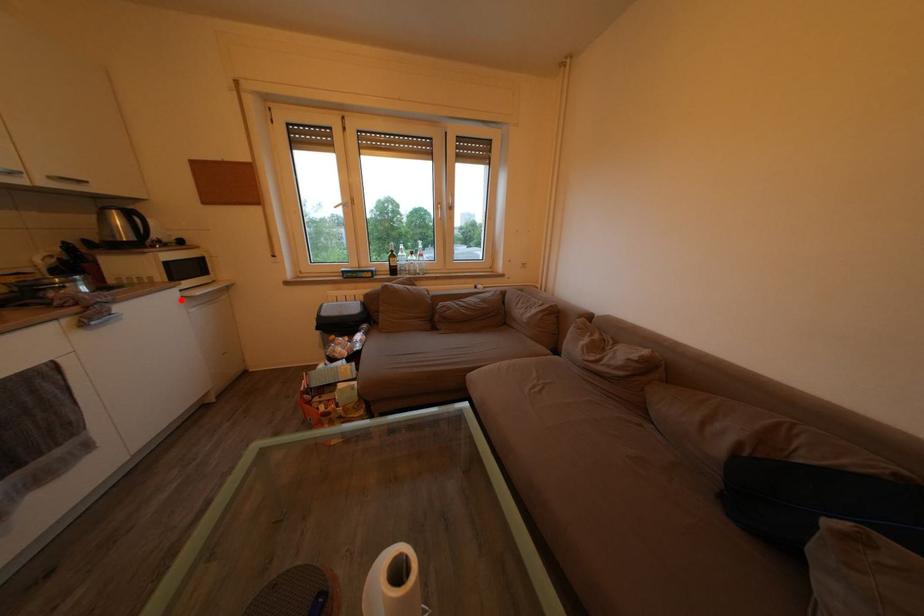
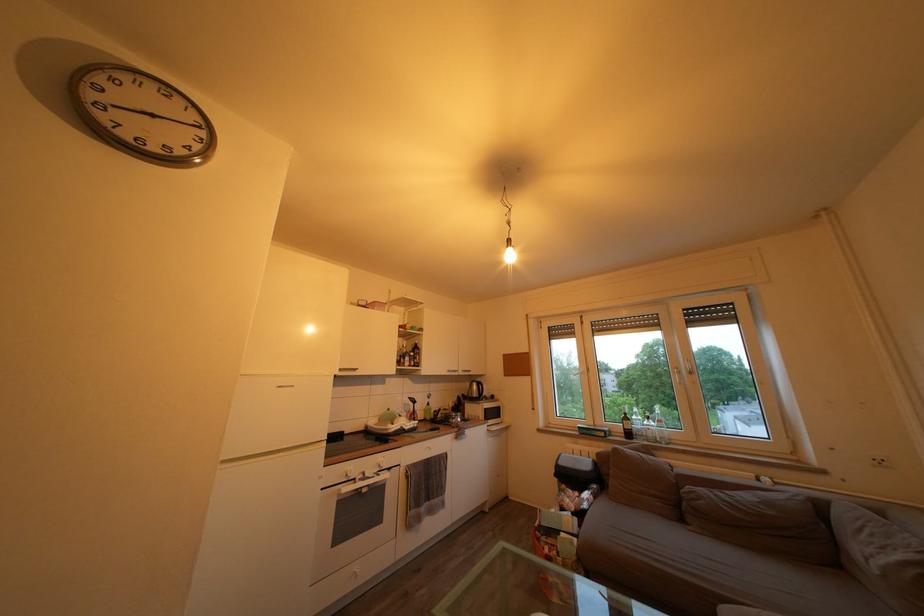
Where in the second image is the point corresponding to the highlighted location from the first image?

(492, 434)